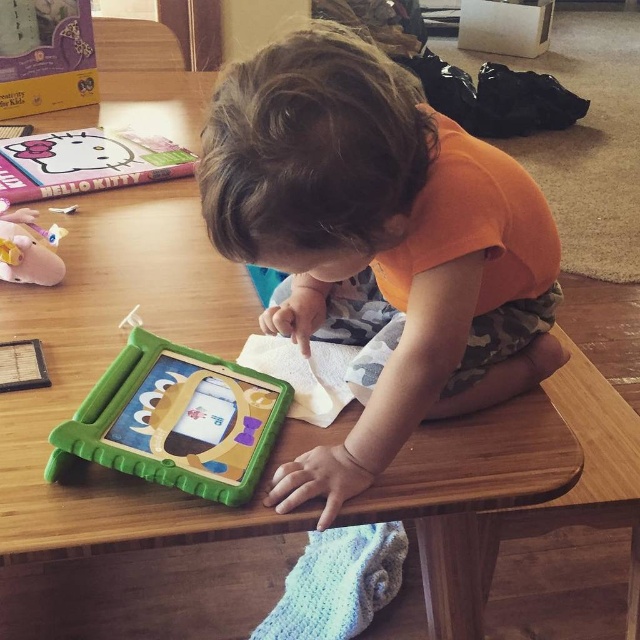
The child is trying to reach for a toy on the table. Considering the distance between the orange cotton toddler at center and the green plastic tablet at center, can the child easily grab the tablet without moving their body?

The distance between the orange cotton toddler at center and the green plastic tablet at center is 8.13 inches, so the child can easily grab the tablet without needing to move their body since the distance is manageable for a toddler to reach.

You are a teacher observing a child in a classroom. You notice the orange cotton toddler at center and the pink rubber piggy bank at left on the table. Which object is closer to you from your viewpoint?

The orange cotton toddler at center is closer to you because it is in front of the pink rubber piggy bank at left.